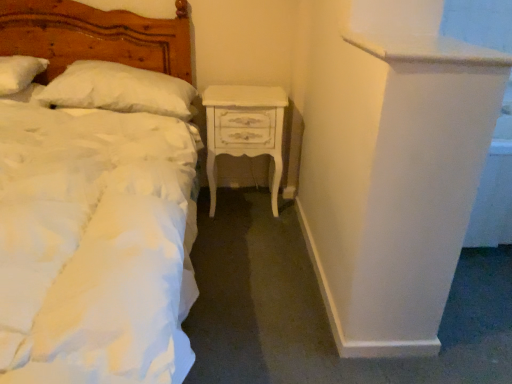
Question: Is white soft pillow at upper left, the 1th pillow from the left, wider or thinner than white fluffy pillow at upper left, which is the 1th pillow in right-to-left order?

Choices:
 (A) thin
 (B) wide

Answer: (A)

Question: From a real-world perspective, is white soft pillow at upper left, the 1th pillow from the left, physically located above or below white fluffy pillow at upper left, which is the 1th pillow in right-to-left order?

Choices:
 (A) above
 (B) below

Answer: (A)

Question: Which object is positioned closest to the matte white bed at left?

Choices:
 (A) white fluffy pillow at upper left, the second pillow from the left
 (B) white soft pillow at upper left, the 1th pillow from the left
 (C) white painted wood nightstand at center

Answer: (A)

Question: Which object is the closest to the matte white bed at left?

Choices:
 (A) white fluffy pillow at upper left, the second pillow from the left
 (B) white painted wood nightstand at center
 (C) white soft pillow at upper left, the 1th pillow from the left

Answer: (A)